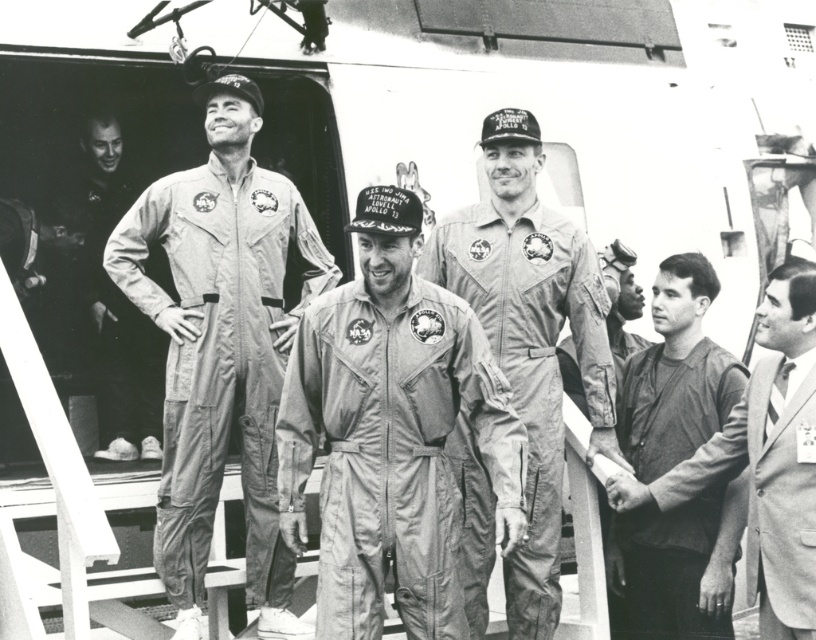
Which is in front, point (173, 301) or point (149, 410)?

Point (173, 301)

Does light gray jumpsuit at center have a lesser height compared to matte white jumpsuit at left?

No.

Which is in front, point (194, 577) or point (131, 388)?

Point (194, 577)

Locate an element on the screen. light gray jumpsuit at center is located at coordinates (220, 346).

Is matte gray jumpsuit at center below dark gray suit at center?

Actually, matte gray jumpsuit at center is above dark gray suit at center.

Does point (389, 496) come closer to viewer compared to point (699, 483)?

Yes, it is in front of point (699, 483).

Where is `matte gray jumpsuit at center`? The height and width of the screenshot is (640, 816). matte gray jumpsuit at center is located at coordinates (391, 433).

This screenshot has width=816, height=640. What are the coordinates of `light gray fabric jumpsuit at center` in the screenshot? It's located at (530, 339).

Can you confirm if light gray fabric jumpsuit at center is wider than matte white jumpsuit at left?

Yes, light gray fabric jumpsuit at center is wider than matte white jumpsuit at left.

Does point (438, 284) lie behind point (123, 387)?

No, it is not.

Where is `light gray fabric jumpsuit at center`? Image resolution: width=816 pixels, height=640 pixels. light gray fabric jumpsuit at center is located at coordinates (530, 339).